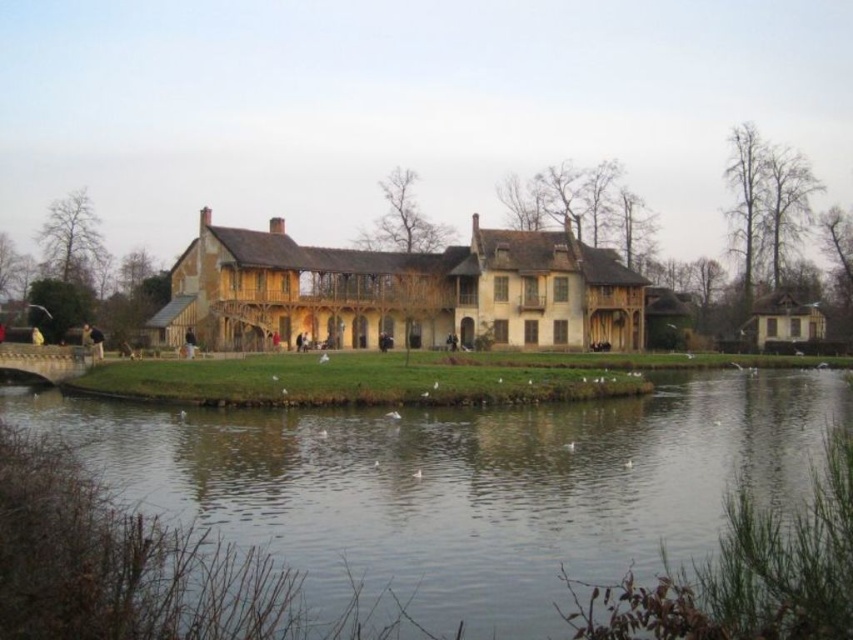
Question: Does green water at lower center appear on the left side of wooden mansion at center?

Choices:
 (A) no
 (B) yes

Answer: (B)

Question: Which object is farther from the camera taking this photo?

Choices:
 (A) green water at lower center
 (B) wooden mansion at center

Answer: (B)

Question: Which object appears closest to the camera in this image?

Choices:
 (A) wooden mansion at center
 (B) wooden thatched-roof cottage at right
 (C) green water at lower center

Answer: (C)

Question: Observing the image, what is the correct spatial positioning of green water at lower center in reference to wooden thatched-roof cottage at right?

Choices:
 (A) right
 (B) left

Answer: (B)

Question: Does green water at lower center appear over wooden mansion at center?

Choices:
 (A) yes
 (B) no

Answer: (B)

Question: Which of these objects is positioned farthest from the wooden mansion at center?

Choices:
 (A) green water at lower center
 (B) wooden thatched-roof cottage at right

Answer: (B)